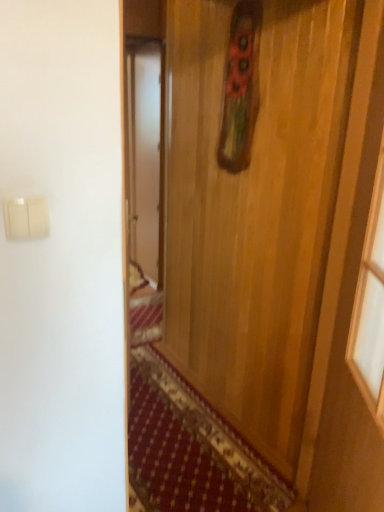
I want to click on wooden door at center, so click(255, 211).

Measure the distance between wooden door at center and camera.

The depth of wooden door at center is 4.32 feet.

The width and height of the screenshot is (384, 512). What do you see at coordinates (255, 211) in the screenshot? I see `wooden door at center` at bounding box center [255, 211].

What do you see at coordinates (26, 218) in the screenshot? I see `white plastic light switch at upper left` at bounding box center [26, 218].

This screenshot has height=512, width=384. I want to click on white plastic light switch at upper left, so click(x=26, y=218).

At what (x,y) coordinates should I click in order to perform the action: click on wooden door at center. Please return your answer as a coordinate pair (x, y). Image resolution: width=384 pixels, height=512 pixels. Looking at the image, I should click on (255, 211).

Visually, is white plastic light switch at upper left positioned to the left or to the right of wooden door at center?

white plastic light switch at upper left is positioned on wooden door at center's left side.

From the picture: Is the depth of white plastic light switch at upper left greater than that of wooden door at center?

No, white plastic light switch at upper left is closer to the viewer.

Which is behind, point (12, 214) or point (222, 336)?

Point (222, 336)

From the image's perspective, is white plastic light switch at upper left under wooden door at center?

No, from the image's perspective, white plastic light switch at upper left is not below wooden door at center.

From a real-world perspective, which object stands above the other?

white plastic light switch at upper left.

Considering the relative sizes of white plastic light switch at upper left and wooden door at center in the image provided, is white plastic light switch at upper left thinner than wooden door at center?

Yes, white plastic light switch at upper left is thinner than wooden door at center.

Looking at this image, which of these two, white plastic light switch at upper left or wooden door at center, stands shorter?

white plastic light switch at upper left.

Between white plastic light switch at upper left and wooden door at center, which one has larger size?

wooden door at center is bigger.

Would you say wooden door at center is part of white plastic light switch at upper left's contents?

No, wooden door at center is not inside white plastic light switch at upper left.

Would you consider white plastic light switch at upper left to be distant from wooden door at center?

Yes, white plastic light switch at upper left and wooden door at center are quite far apart.

Could you tell me if white plastic light switch at upper left is turned towards wooden door at center?

No.

What's the angular difference between white plastic light switch at upper left and wooden door at center's facing directions?

white plastic light switch at upper left and wooden door at center are facing 0.406 degrees away from each other.

You are a GUI agent. You are given a task and a screenshot of the screen. Output one action in this format:
    pyautogui.click(x=<x>, y=<y>)
    Task: Click on the door beneath the white plastic light switch at upper left (from a real-world perspective)
    This screenshot has width=384, height=512.
    Given the screenshot: What is the action you would take?
    pyautogui.click(x=255, y=211)

Considering the relative positions of wooden door at center and white plastic light switch at upper left in the image provided, is wooden door at center to the left of white plastic light switch at upper left from the viewer's perspective?

No.

Is the depth of wooden door at center less than that of white plastic light switch at upper left?

No, it is behind white plastic light switch at upper left.

Which point is more distant from viewer, [219,230] or [5,202]?

Positioned behind is point [219,230].

In the scene shown: From the image's perspective, is wooden door at center located beneath white plastic light switch at upper left?

Yes, from the image's perspective, wooden door at center is below white plastic light switch at upper left.

From a real-world perspective, is wooden door at center positioned over white plastic light switch at upper left based on gravity?

Actually, wooden door at center is physically below white plastic light switch at upper left in the real world.

Which object is wider, wooden door at center or white plastic light switch at upper left?

With larger width is wooden door at center.

Consider the image. Which of these two, wooden door at center or white plastic light switch at upper left, stands taller?

With more height is wooden door at center.

Does wooden door at center have a smaller size compared to white plastic light switch at upper left?

No.

Is white plastic light switch at upper left completely or partially inside wooden door at center?

No, white plastic light switch at upper left is not inside wooden door at center.

Are wooden door at center and white plastic light switch at upper left far apart?

Yes, wooden door at center is far from white plastic light switch at upper left.

Is white plastic light switch at upper left at the back of wooden door at center?

wooden door at center is not turned away from white plastic light switch at upper left.

How many degrees apart are the facing directions of wooden door at center and white plastic light switch at upper left?

They differ by 0.406 degrees in their facing directions.

I want to click on light switch in front of the wooden door at center, so click(26, 218).

Where is `door that appears behind the white plastic light switch at upper left`? The image size is (384, 512). door that appears behind the white plastic light switch at upper left is located at coordinates (255, 211).

In the image, there is a wooden door at center. Where is `light switch above it (from the image's perspective)`? This screenshot has height=512, width=384. light switch above it (from the image's perspective) is located at coordinates (26, 218).